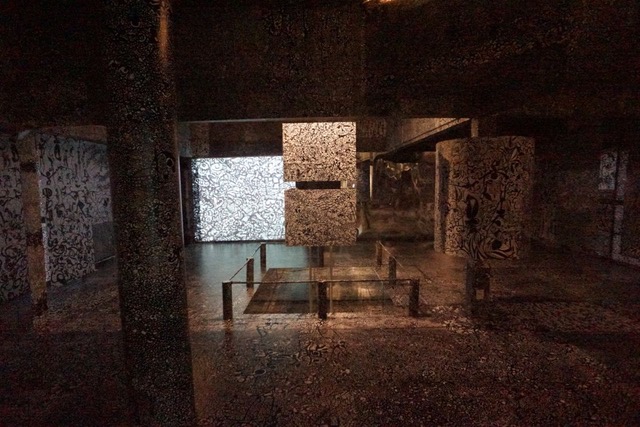
Find the location of `art`. art is located at coordinates (230, 204).